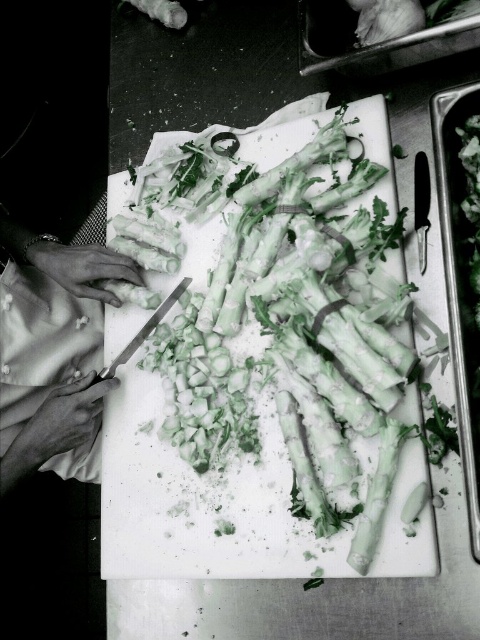
Is white plastic cutting board at center bigger than white matte onion at upper right?

Correct, white plastic cutting board at center is larger in size than white matte onion at upper right.

Who is taller, white plastic cutting board at center or white matte onion at upper right?

white plastic cutting board at center is taller.

Identify the location of white plastic cutting board at center. (199, 502).

Can you confirm if white matte onion at upper right is positioned below silver metallic knife at center-left?

Incorrect, white matte onion at upper right is not positioned below silver metallic knife at center-left.

Is white matte onion at upper right wider than silver metallic knife at center-left?

Incorrect, white matte onion at upper right's width does not surpass silver metallic knife at center-left's.

Measure the distance between white matte onion at upper right and camera.

white matte onion at upper right is 30.28 inches from camera.

You are a GUI agent. You are given a task and a screenshot of the screen. Output one action in this format:
    pyautogui.click(x=<x>, y=<y>)
    Task: Click on the white matte onion at upper right
    
    Given the screenshot: What is the action you would take?
    pyautogui.click(x=385, y=19)

What do you see at coordinates (54, 424) in the screenshot? I see `smooth white hands at lower left` at bounding box center [54, 424].

Who is positioned more to the right, smooth white hands at lower left or white matte onion at upper right?

Positioned to the right is white matte onion at upper right.

Is point (107, 273) positioned after point (384, 40)?

Yes, it is behind point (384, 40).

The image size is (480, 640). I want to click on smooth white hands at lower left, so (x=54, y=424).